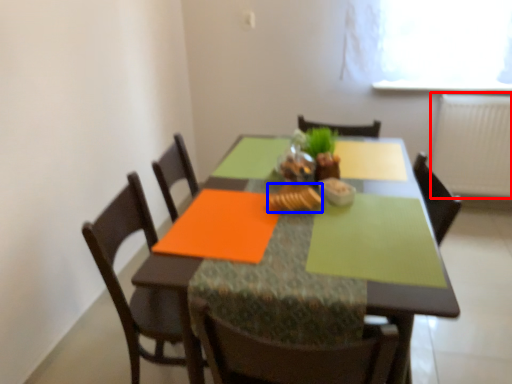
Question: Which point is closer to the camera, radiator (highlighted by a red box) or food (highlighted by a blue box)?

Choices:
 (A) radiator
 (B) food

Answer: (B)